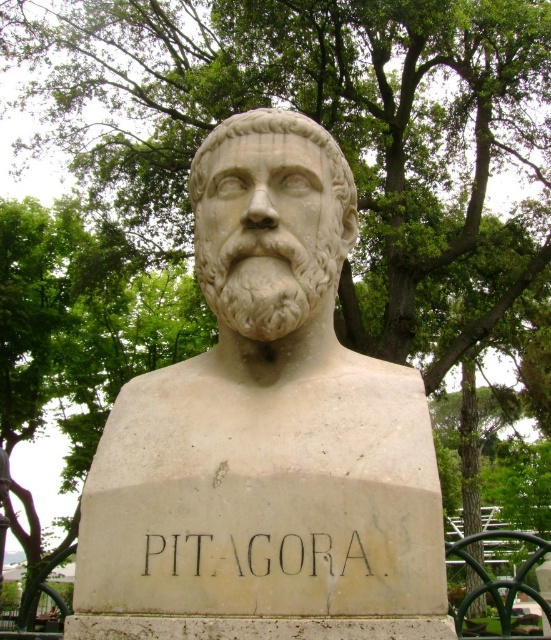
Question: Which point is closer to the camera taking this photo?

Choices:
 (A) (353, 188)
 (B) (393, 596)

Answer: (B)

Question: Among these objects, which one is nearest to the camera?

Choices:
 (A) white stone bust at center
 (B) white marble bust at center

Answer: (A)

Question: Is white stone bust at center to the left of white marble bust at center from the viewer's perspective?

Choices:
 (A) no
 (B) yes

Answer: (A)

Question: Is the position of white stone bust at center more distant than that of white marble bust at center?

Choices:
 (A) no
 (B) yes

Answer: (A)

Question: Which object appears closest to the camera in this image?

Choices:
 (A) white marble bust at center
 (B) white stone bust at center

Answer: (B)

Question: Considering the relative positions of white stone bust at center and white marble bust at center in the image provided, where is white stone bust at center located with respect to white marble bust at center?

Choices:
 (A) right
 (B) left

Answer: (A)